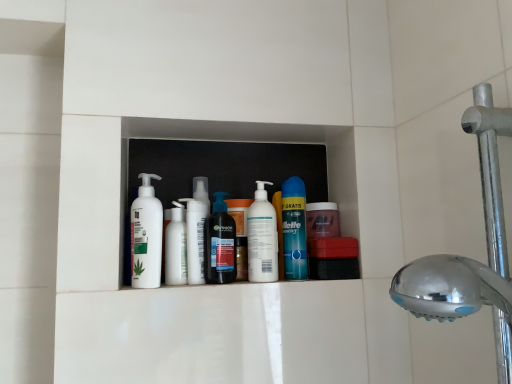
Question: Is chrome metallic shower head at right in contact with white matte pump bottle at center, which is counted as the 2th cleaning product, starting from the right?

Choices:
 (A) no
 (B) yes

Answer: (A)

Question: Considering the relative sizes of chrome metallic shower head at right and white matte pump bottle at center, which is counted as the 2th cleaning product, starting from the right, in the image provided, is chrome metallic shower head at right taller than white matte pump bottle at center, which is counted as the 2th cleaning product, starting from the right,?

Choices:
 (A) yes
 (B) no

Answer: (A)

Question: Is chrome metallic shower head at right thinner than white matte pump bottle at center, acting as the 4th cleaning product starting from the left?

Choices:
 (A) no
 (B) yes

Answer: (A)

Question: Does chrome metallic shower head at right lie in front of white matte pump bottle at center, acting as the 4th cleaning product starting from the left?

Choices:
 (A) no
 (B) yes

Answer: (B)

Question: From a real-world perspective, does chrome metallic shower head at right sit lower than white matte pump bottle at center, which is counted as the 2th cleaning product, starting from the right?

Choices:
 (A) yes
 (B) no

Answer: (A)

Question: Does chrome metallic shower head at right turn towards white matte pump bottle at center, which is counted as the 2th cleaning product, starting from the right?

Choices:
 (A) no
 (B) yes

Answer: (A)

Question: Can you confirm if white glossy lotion at center is thinner than white matte bottle at center, the fourth cleaning product from the right?

Choices:
 (A) yes
 (B) no

Answer: (B)

Question: From the image's perspective, is white glossy lotion at center located beneath white matte bottle at center, positioned as the 2th cleaning product in left-to-right order?

Choices:
 (A) no
 (B) yes

Answer: (B)

Question: Does white glossy lotion at center appear on the right side of white matte bottle at center, the fourth cleaning product from the right?

Choices:
 (A) yes
 (B) no

Answer: (B)

Question: Is the position of white glossy lotion at center more distant than that of white matte bottle at center, positioned as the 2th cleaning product in left-to-right order?

Choices:
 (A) yes
 (B) no

Answer: (A)

Question: Is white glossy lotion at center positioned far away from white matte bottle at center, the fourth cleaning product from the right?

Choices:
 (A) no
 (B) yes

Answer: (A)

Question: From a real-world perspective, is white glossy lotion at center physically below white matte bottle at center, the fourth cleaning product from the right?

Choices:
 (A) no
 (B) yes

Answer: (A)

Question: Does white matte lotion at center, acting as the 5th cleaning product starting from the right, have a lesser height compared to white matte pump bottle at center, acting as the 4th cleaning product starting from the left?

Choices:
 (A) yes
 (B) no

Answer: (B)